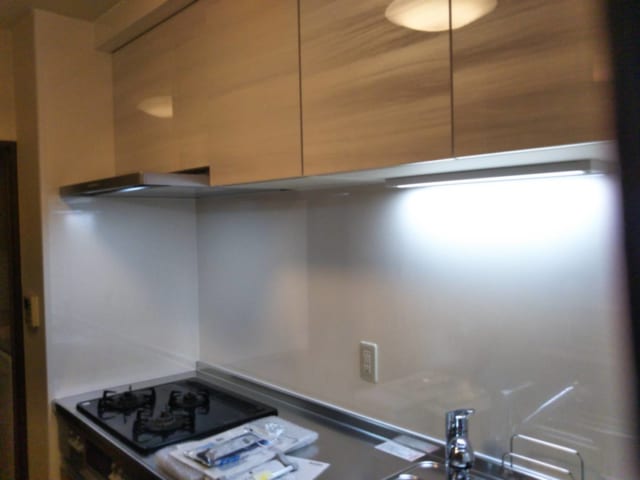
This screenshot has height=480, width=640. Find the location of `burner 2`. burner 2 is located at coordinates (123, 396).